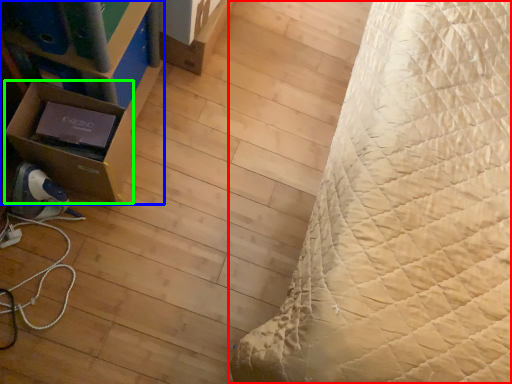
Question: Which object is positioned closest to bed (highlighted by a red box)? Select from furniture (highlighted by a blue box) and cardboard box (highlighted by a green box).

Choices:
 (A) furniture
 (B) cardboard box

Answer: (A)